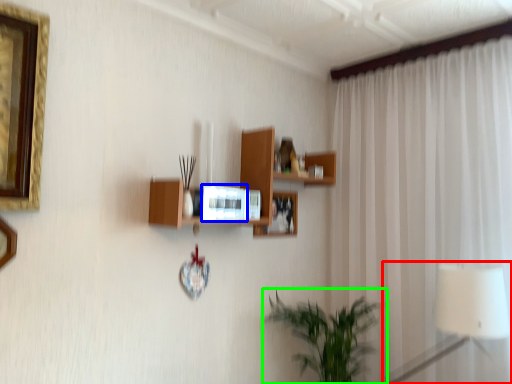
Question: Estimate the real-world distances between objects in this image. Which object is closer to table lamp (highlighted by a red box), picture frame (highlighted by a blue box) or houseplant (highlighted by a green box)?

Choices:
 (A) picture frame
 (B) houseplant

Answer: (B)